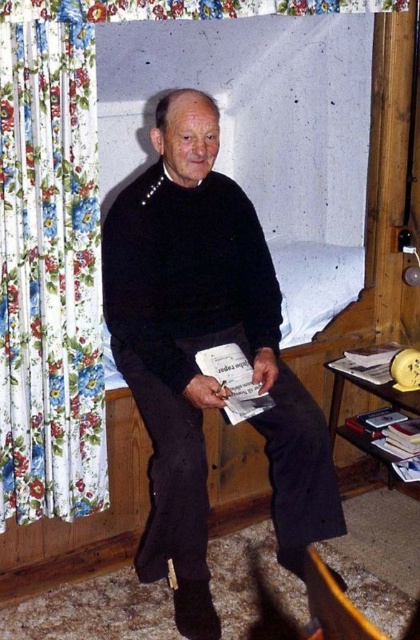
Where is the black matte sweater at center located in the image?

The black matte sweater at center is located at point coordinates of 0.545 on the x axis and 0.486 on the y axis.

From the picture: You are a tailor measuring garments in a rustic room with a floral curtain on the left. You need to place both the black matte sweater at center and the white paper book at center on a shelf. Which object requires a wider space to fit properly?

The black matte sweater at center requires a wider space because its width surpasses that of the white paper book at center.

You are standing in the room and want to hand the man a gift box that is 1 foot in length. The black matte sweater at center is the closest item to you. Can you reach the man without moving closer than 6 feet?

The black matte sweater at center and viewer are 6.27 feet apart from each other. Since the distance is more than 6 feet, you can hand the gift box without moving closer than 6 feet as the distance is sufficient.